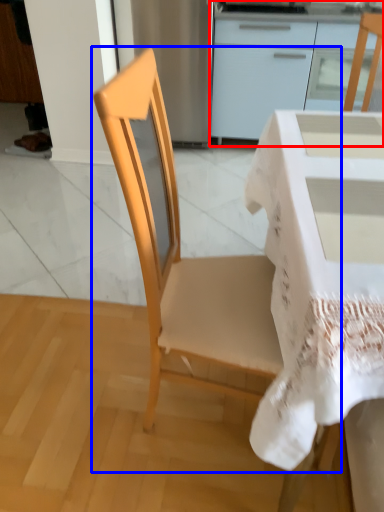
Question: Which object is further to the camera taking this photo, cabinetry (highlighted by a red box) or chair (highlighted by a blue box)?

Choices:
 (A) cabinetry
 (B) chair

Answer: (A)